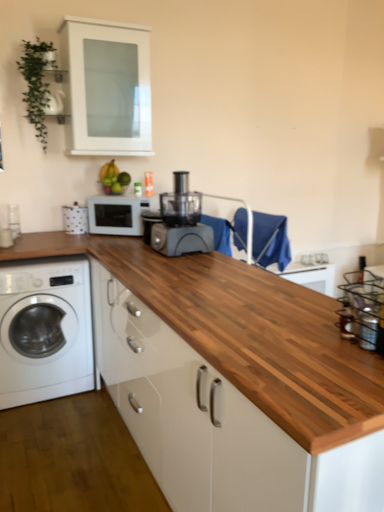
The image size is (384, 512). What are the coordinates of `clear glass bottle at right` in the screenshot? It's located at (346, 320).

In order to face white glossy washing machine at lower left, should I rotate leftwards or rightwards?

Rotate your view left by about 19.614°.

Locate an element on the screen. This screenshot has width=384, height=512. white matte cabinet at upper center is located at coordinates (107, 86).

Between white glossy washing machine at lower left and white matte microwave at center, which one has less height?

Standing shorter between the two is white matte microwave at center.

Based on the photo, between white glossy washing machine at lower left and white matte microwave at center, which one has larger width?

Wider between the two is white glossy washing machine at lower left.

From a real-world perspective, is white glossy washing machine at lower left above or below white matte microwave at center?

white glossy washing machine at lower left is below white matte microwave at center.

Is the surface of white glossy washing machine at lower left in direct contact with white matte microwave at center?

No, white glossy washing machine at lower left is not touching white matte microwave at center.

Is green matte bananas at upper center taller than white matte microwave at center?

In fact, green matte bananas at upper center may be shorter than white matte microwave at center.

From a real-world perspective, is green matte bananas at upper center positioned above or below white matte microwave at center?

Clearly, from a real-world perspective, green matte bananas at upper center is above white matte microwave at center.

Does point (126, 177) appear closer or farther from the camera than point (125, 204)?

Clearly, point (126, 177) is more distant from the camera than point (125, 204).

Identify the location of fruit above the white matte microwave at center (from the image's perspective). The image size is (384, 512). (113, 179).

Would you say green matte bananas at upper center is a long distance from matte black food processor at center?

They are positioned close to each other.

Considering the relative sizes of green matte bananas at upper center and matte black food processor at center in the image provided, is green matte bananas at upper center thinner than matte black food processor at center?

Indeed, green matte bananas at upper center has a lesser width compared to matte black food processor at center.

Is matte black food processor at center at the back of green matte bananas at upper center?

green matte bananas at upper center is not turned away from matte black food processor at center.

Find the location of a particular element. The height and width of the screenshot is (512, 384). fruit above the matte black food processor at center (from the image's perspective) is located at coordinates (113, 179).

Is white matte cabinet at upper center in front of or behind green matte bananas at upper center in the image?

white matte cabinet at upper center is in front of green matte bananas at upper center.

Is white matte cabinet at upper center next to green matte bananas at upper center and touching it?

white matte cabinet at upper center and green matte bananas at upper center are clearly separated.

From the image's perspective, who appears lower, white matte cabinet at upper center or green matte bananas at upper center?

green matte bananas at upper center, from the image's perspective.

Find the location of a particular element. The image size is (384, 512). home appliance located in front of the white glossy washing machine at lower left is located at coordinates (181, 221).

From a real-world perspective, is matte black food processor at center over white glossy washing machine at lower left?

Yes.

Is clear glass bottle at right facing away from white glossy washing machine at lower left?

No.

Which point is more distant from viewer, (347, 331) or (0, 272)?

The point (0, 272) is farther from the camera.

What's the angular difference between clear glass bottle at right and white glossy washing machine at lower left's facing directions?

They differ by 90.4 degrees in their facing directions.

From a real-world perspective, which object rests below the other?

white glossy washing machine at lower left.

Is there a large distance between white glossy washing machine at lower left and clear glass bottle at right?

Yes, white glossy washing machine at lower left is far from clear glass bottle at right.

Considering their positions, is white glossy washing machine at lower left located in front of or behind clear glass bottle at right?

white glossy washing machine at lower left is behind clear glass bottle at right.

Does white glossy washing machine at lower left have a larger size compared to clear glass bottle at right?

Yes.

Where is `microwave oven behind the white glossy washing machine at lower left`? The height and width of the screenshot is (512, 384). microwave oven behind the white glossy washing machine at lower left is located at coordinates (117, 214).

The height and width of the screenshot is (512, 384). In order to click on microwave oven located underneath the green matte bananas at upper center (from a real-world perspective) in this screenshot , I will do `click(117, 214)`.

From the image, which object appears to be farther from green matte bananas at upper center, white matte cabinet at upper center or white matte microwave at center?

white matte cabinet at upper center is positioned further to the anchor green matte bananas at upper center.

When comparing their distances from white matte cabinet at upper center, does clear glass bottle at right or white matte microwave at center seem further?

clear glass bottle at right lies further to white matte cabinet at upper center than the other object.

From the image, which object appears to be farther from green matte bananas at upper center, white matte cabinet at upper center or white glossy washing machine at lower left?

Based on the image, white glossy washing machine at lower left appears to be further to green matte bananas at upper center.

Based on their spatial positions, is clear glass bottle at right or white matte cabinet at upper center closer to white matte microwave at center?

Based on the image, white matte cabinet at upper center appears to be nearer to white matte microwave at center.

From the picture: Considering their positions, is white glossy washing machine at lower left positioned closer to wooden at center than white matte microwave at center?

white glossy washing machine at lower left is positioned closer to the anchor wooden at center.

Estimate the real-world distances between objects in this image. Which object is closer to white glossy washing machine at lower left, wooden at center or white matte microwave at center?

white matte microwave at center is positioned closer to the anchor white glossy washing machine at lower left.

Looking at the image, which one is located further to matte black food processor at center, wooden at center or clear glass bottle at right?

Based on the image, clear glass bottle at right appears to be further to matte black food processor at center.

Estimate the real-world distances between objects in this image. Which object is closer to matte black food processor at center, wooden at center or green matte bananas at upper center?

Among the two, green matte bananas at upper center is located nearer to matte black food processor at center.

Identify the location of washing machine positioned between wooden at center and white matte cabinet at upper center from near to far. (45, 330).

This screenshot has width=384, height=512. What are the coordinates of `bottle between white matte cabinet at upper center and white glossy washing machine at lower left vertically` in the screenshot? It's located at (346, 320).

Find the location of a particular element. microwave oven located between wooden at center and green matte bananas at upper center in the depth direction is located at coordinates pyautogui.click(x=117, y=214).

Where is `microwave oven between white matte cabinet at upper center and matte black food processor at center vertically`? The width and height of the screenshot is (384, 512). microwave oven between white matte cabinet at upper center and matte black food processor at center vertically is located at coordinates (117, 214).